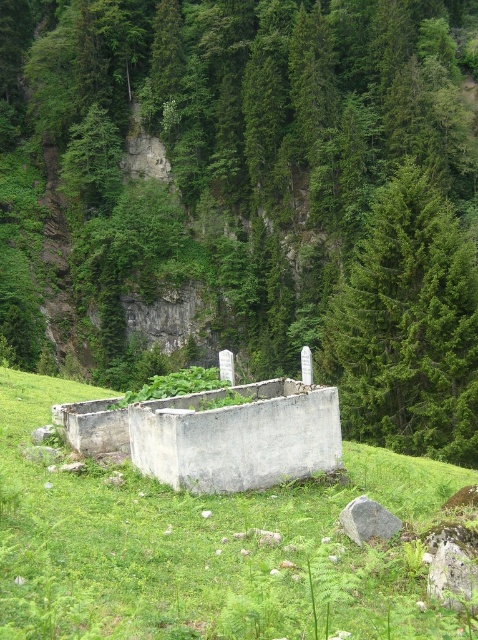
Question: Is green leafy tree at center to the left of green grassy at center from the viewer's perspective?

Choices:
 (A) yes
 (B) no

Answer: (B)

Question: Which object is closer to the camera taking this photo?

Choices:
 (A) white concrete wall at center
 (B) green leafy tree at center
 (C) green evergreen tree at upper right
 (D) green grassy at center

Answer: (D)

Question: Can you confirm if green leafy tree at center is positioned to the right of white concrete wall at center?

Choices:
 (A) no
 (B) yes

Answer: (B)

Question: Is white concrete wall at center positioned at the back of gray rough rock at lower center?

Choices:
 (A) no
 (B) yes

Answer: (B)

Question: Which point appears farthest from the camera in this image?

Choices:
 (A) (7, 525)
 (B) (336, 307)
 (C) (283, 417)
 (D) (361, 536)

Answer: (B)

Question: Among these objects, which one is farthest from the camera?

Choices:
 (A) gray rough rock at lower center
 (B) green leafy tree at center

Answer: (B)